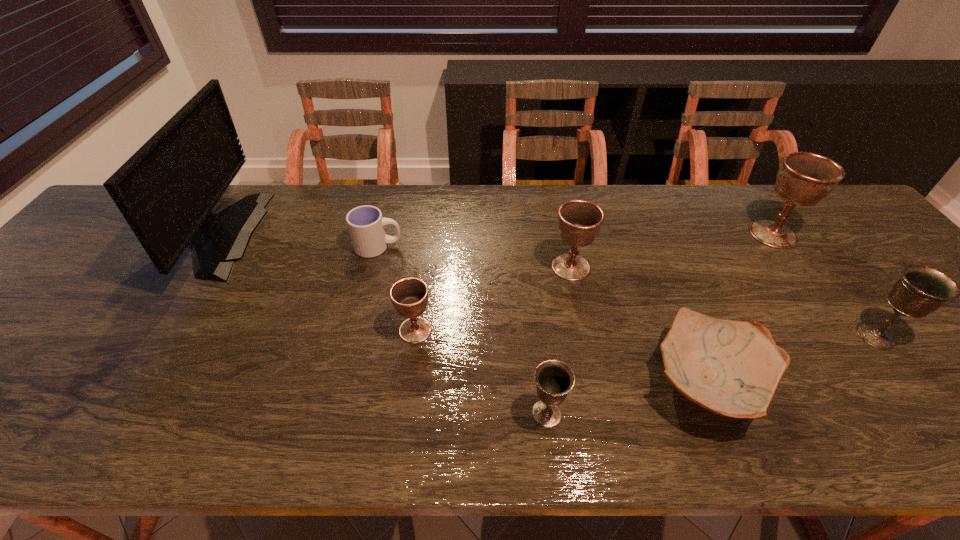
Locate an element on the screen. object that is the fifth closest one to the second object from left to right is located at coordinates (732, 368).

Identify which chalice is located as the nearest to the fourth chalice from right to left. Please provide its 2D coordinates. Your answer should be formatted as a tuple, i.e. [(x, y)], where the tuple contains the x and y coordinates of a point satisfying the conditions above.

[(409, 296)]

Find the location of `the second closest chalice to the nearest brown chalice`. the second closest chalice to the nearest brown chalice is located at coordinates (579, 221).

The width and height of the screenshot is (960, 540). I want to click on brown chalice that can be found as the second closest to the second smallest brown chalice, so pyautogui.click(x=804, y=179).

Find the location of a particular element. The image size is (960, 540). brown chalice that is the closest to the sixth object from left to right is located at coordinates (579, 221).

This screenshot has width=960, height=540. I want to click on free space that satisfies the following two spatial constraints: 1. on the back side of the smaller bronze chalice; 2. on the left side of the right bronze chalice, so click(538, 335).

The height and width of the screenshot is (540, 960). Find the location of `blank area in the image that satisfies the following two spatial constraints: 1. on the back side of the farthest chalice; 2. on the screen side of the tallest object`. blank area in the image that satisfies the following two spatial constraints: 1. on the back side of the farthest chalice; 2. on the screen side of the tallest object is located at coordinates (773, 234).

Where is `blank area in the image that satisfies the following two spatial constraints: 1. with the handle on the side of the leftmost brown chalice; 2. on the right side of the seventh object from right to left`? The width and height of the screenshot is (960, 540). blank area in the image that satisfies the following two spatial constraints: 1. with the handle on the side of the leftmost brown chalice; 2. on the right side of the seventh object from right to left is located at coordinates (359, 330).

Identify the location of free space that satisfies the following two spatial constraints: 1. on the back side of the leftmost chalice; 2. on the left side of the farthest brown chalice. (427, 234).

The image size is (960, 540). Find the location of `vacant space that satisfies the following two spatial constraints: 1. with the handle on the side of the cup; 2. on the right side of the second nearest brown chalice`. vacant space that satisfies the following two spatial constraints: 1. with the handle on the side of the cup; 2. on the right side of the second nearest brown chalice is located at coordinates (373, 267).